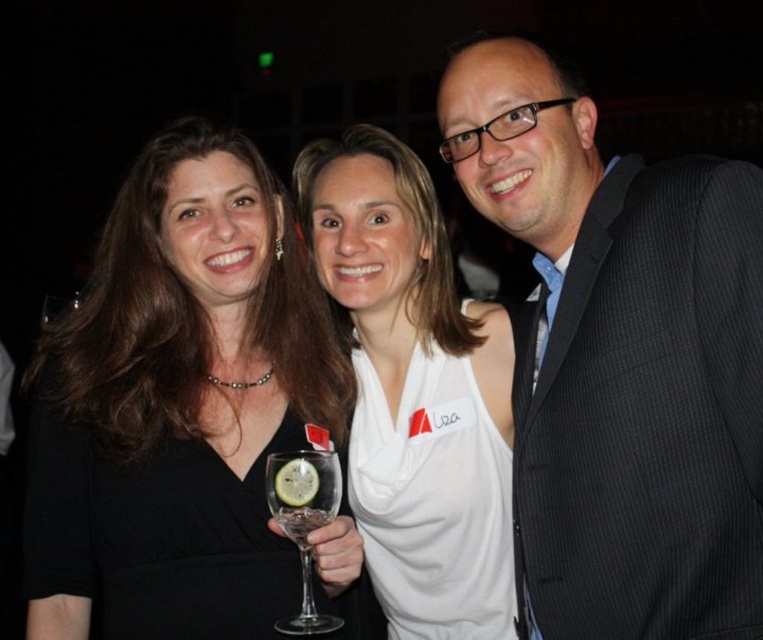
Does dark gray pinstripe suit at center come in front of clear glass wine glass at center?

Yes.

Which of these two, dark gray pinstripe suit at center or clear glass wine glass at center, stands shorter?

clear glass wine glass at center is shorter.

Where is `dark gray pinstripe suit at center`? dark gray pinstripe suit at center is located at coordinates (620, 358).

Where is `dark gray pinstripe suit at center`? This screenshot has height=640, width=763. dark gray pinstripe suit at center is located at coordinates (620, 358).

Which of these two, black matte dress at center or white jersey at center, stands shorter?

white jersey at center is shorter.

The height and width of the screenshot is (640, 763). Find the location of `black matte dress at center`. black matte dress at center is located at coordinates point(176,404).

Where is `black matte dress at center`? black matte dress at center is located at coordinates (176, 404).

The height and width of the screenshot is (640, 763). Describe the element at coordinates (176, 404) in the screenshot. I see `black matte dress at center` at that location.

Is black matte dress at center below white matte tank top at center?

Correct, black matte dress at center is located below white matte tank top at center.

Does point (98, 307) come farther from viewer compared to point (366, 461)?

No, it is in front of (366, 461).

What are the coordinates of `black matte dress at center` in the screenshot? It's located at (176, 404).